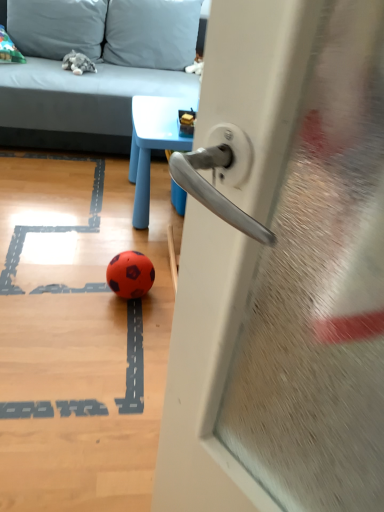
Find the location of a particular element. This screenshot has width=384, height=512. vacant area to the left of gray plush toy at upper left is located at coordinates (46, 66).